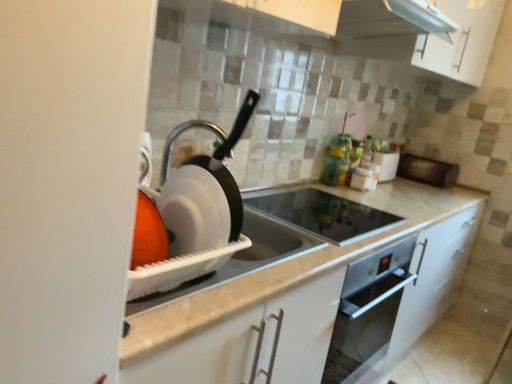
Question: From the image's perspective, is black matte microwave at right, placed as the 4th appliance when sorted from left to right, above white glossy exhaust hood at upper center?

Choices:
 (A) yes
 (B) no

Answer: (B)

Question: Is black matte microwave at right, the 1th appliance from the back, not near white glossy exhaust hood at upper center?

Choices:
 (A) no
 (B) yes

Answer: (B)

Question: Is black matte microwave at right, placed as the 4th appliance when sorted from left to right, oriented away from white glossy exhaust hood at upper center?

Choices:
 (A) yes
 (B) no

Answer: (B)

Question: Can you see black matte microwave at right, placed as the 4th appliance when sorted from left to right, touching white glossy exhaust hood at upper center?

Choices:
 (A) no
 (B) yes

Answer: (A)

Question: From a real-world perspective, is black matte microwave at right, which ranks as the fourth appliance in front-to-back order, over white glossy exhaust hood at upper center?

Choices:
 (A) no
 (B) yes

Answer: (A)

Question: Considering their positions, is white glossy toaster at upper right, the 2th appliance viewed from the back, located in front of or behind white glossy exhaust hood at upper center?

Choices:
 (A) behind
 (B) front

Answer: (A)

Question: From a real-world perspective, is white glossy toaster at upper right, the 2th appliance viewed from the back, positioned above or below white glossy exhaust hood at upper center?

Choices:
 (A) above
 (B) below

Answer: (B)

Question: Considering the positions of white glossy toaster at upper right, the second appliance when ordered from right to left, and white glossy exhaust hood at upper center in the image, is white glossy toaster at upper right, the second appliance when ordered from right to left, taller or shorter than white glossy exhaust hood at upper center?

Choices:
 (A) tall
 (B) short

Answer: (B)

Question: Considering the positions of point (392, 155) and point (350, 34), is point (392, 155) closer or farther from the camera than point (350, 34)?

Choices:
 (A) closer
 (B) farther

Answer: (B)

Question: Is white glossy toaster at upper right, the second appliance when ordered from right to left, inside or outside of white plastic dish rack at left, the fourth appliance when ordered from back to front?

Choices:
 (A) inside
 (B) outside

Answer: (B)

Question: Is point [375, 157] positioned closer to the camera than point [217, 147]?

Choices:
 (A) closer
 (B) farther

Answer: (B)

Question: Considering the positions of white glossy toaster at upper right, the 2th appliance viewed from the back, and white plastic dish rack at left, which is the 4th appliance from right to left, in the image, is white glossy toaster at upper right, the 2th appliance viewed from the back, taller or shorter than white plastic dish rack at left, which is the 4th appliance from right to left,?

Choices:
 (A) short
 (B) tall

Answer: (A)

Question: Visually, is white glossy toaster at upper right, the 3th appliance in the left-to-right sequence, positioned to the left or to the right of white plastic dish rack at left, which is the 4th appliance from right to left?

Choices:
 (A) left
 (B) right

Answer: (B)

Question: Considering the positions of black glass cooktop at center, the second appliance when ordered from left to right, and white marble countertop at center in the image, is black glass cooktop at center, the second appliance when ordered from left to right, wider or thinner than white marble countertop at center?

Choices:
 (A) wide
 (B) thin

Answer: (B)

Question: From a real-world perspective, is black glass cooktop at center, which appears as the 3th appliance when viewed from the back, above or below white marble countertop at center?

Choices:
 (A) above
 (B) below

Answer: (A)